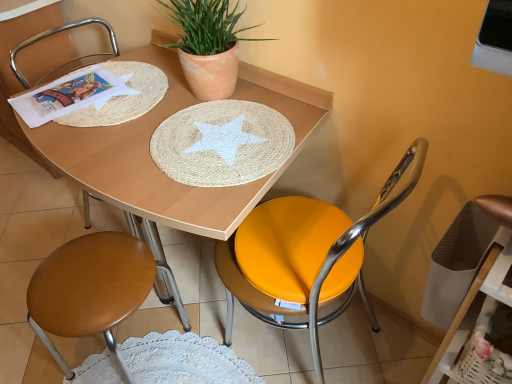
Question: Which direction should I rotate to face metallic yellow seat at center, positioned as the 1th chair in right-to-left order, — up or down?

Choices:
 (A) up
 (B) down

Answer: (B)

Question: Considering the relative sizes of brown leather stool at lower left, positioned as the second chair in left-to-right order, and matte terracotta pot at upper center in the image provided, is brown leather stool at lower left, positioned as the second chair in left-to-right order, wider than matte terracotta pot at upper center?

Choices:
 (A) no
 (B) yes

Answer: (B)

Question: From the image's perspective, is brown leather stool at lower left, positioned as the second chair in left-to-right order, on matte terracotta pot at upper center?

Choices:
 (A) yes
 (B) no

Answer: (B)

Question: Can matte terracotta pot at upper center be found inside brown leather stool at lower left, positioned as the second chair in left-to-right order?

Choices:
 (A) yes
 (B) no

Answer: (B)

Question: Would you consider brown leather stool at lower left, the 2th chair viewed from the right, to be distant from matte terracotta pot at upper center?

Choices:
 (A) no
 (B) yes

Answer: (A)

Question: Is brown leather stool at lower left, the 2th chair viewed from the right, positioned beyond the bounds of matte terracotta pot at upper center?

Choices:
 (A) yes
 (B) no

Answer: (A)

Question: Considering the relative sizes of brown leather stool at lower left, positioned as the second chair in left-to-right order, and matte terracotta pot at upper center in the image provided, is brown leather stool at lower left, positioned as the second chair in left-to-right order, thinner than matte terracotta pot at upper center?

Choices:
 (A) yes
 (B) no

Answer: (B)

Question: Is brown leather stool at lower left, which is counted as the 3th chair, starting from the right, at the right side of matte wood table at center?

Choices:
 (A) no
 (B) yes

Answer: (A)

Question: Can you confirm if brown leather stool at lower left, which is counted as the 3th chair, starting from the right, is smaller than matte wood table at center?

Choices:
 (A) yes
 (B) no

Answer: (A)

Question: Does brown leather stool at lower left, which is counted as the 3th chair, starting from the right, have a larger size compared to matte wood table at center?

Choices:
 (A) yes
 (B) no

Answer: (B)

Question: Considering the relative sizes of brown leather stool at lower left, arranged as the first chair when viewed from the left, and matte wood table at center in the image provided, is brown leather stool at lower left, arranged as the first chair when viewed from the left, wider than matte wood table at center?

Choices:
 (A) no
 (B) yes

Answer: (A)

Question: Is brown leather stool at lower left, which is counted as the 3th chair, starting from the right, behind matte wood table at center?

Choices:
 (A) no
 (B) yes

Answer: (B)

Question: From the image's perspective, is brown leather stool at lower left, which is counted as the 3th chair, starting from the right, beneath matte wood table at center?

Choices:
 (A) no
 (B) yes

Answer: (A)

Question: Is metallic yellow seat at center, which ranks as the third chair in left-to-right order, further to camera compared to brown leather stool at lower left, which is counted as the 3th chair, starting from the right?

Choices:
 (A) no
 (B) yes

Answer: (A)